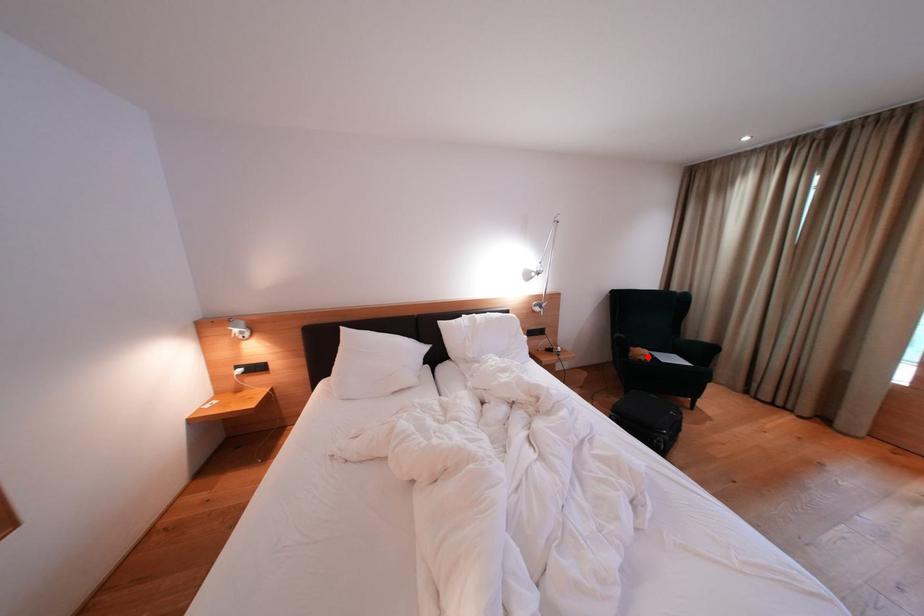
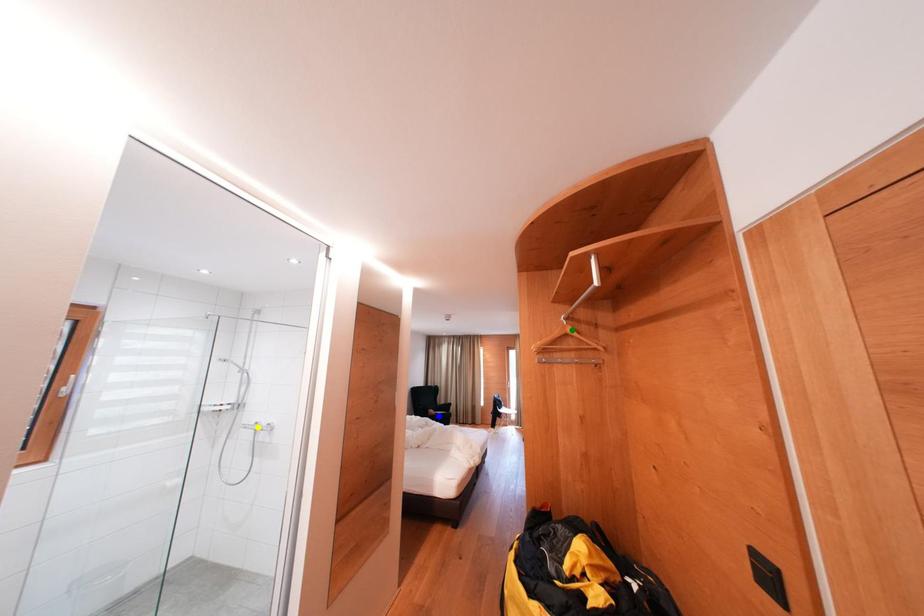
Question: I am providing you with two images of the same scene from different viewpoints. A red point is marked on the first image. You are given multiple points on the second image. Which spot in image 2 lines up with the point in image 1?

Choices:
 (A) yellow point
 (B) blue point
 (C) green point

Answer: (B)